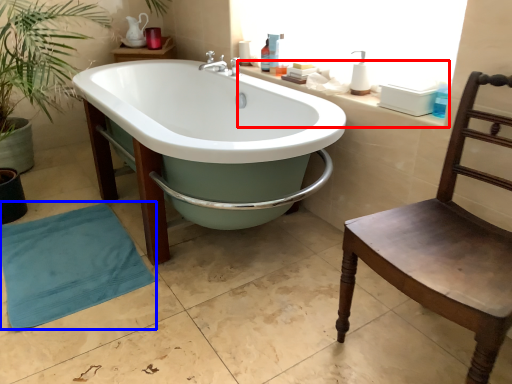
Question: Which of the following is the closest to the observer, counter top (highlighted by a red box) or beach towel (highlighted by a blue box)?

Choices:
 (A) counter top
 (B) beach towel

Answer: (A)